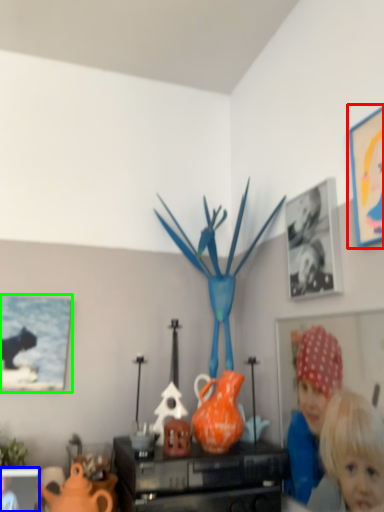
Question: Estimate the real-world distances between objects in this image. Which object is closer to picture frame (highlighted by a red box), picture frame (highlighted by a blue box) or picture frame (highlighted by a green box)?

Choices:
 (A) picture frame
 (B) picture frame

Answer: (B)